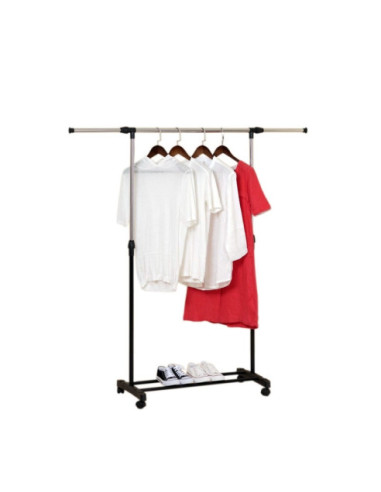
Where is `shirt hangers`? shirt hangers is located at coordinates (221, 150), (201, 150), (177, 150), (158, 150).